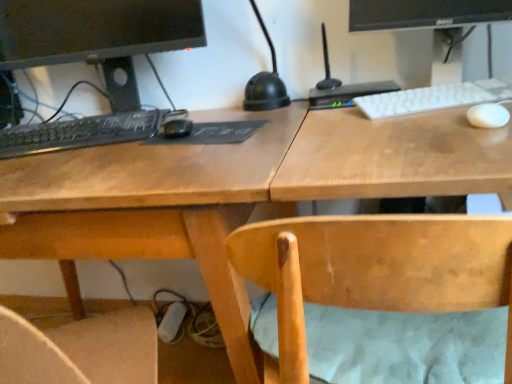
Measure the distance between light brown wood chair at center and camera.

14.85 inches.

Find the location of a particular element. The image size is (512, 384). light brown wood chair at center is located at coordinates (375, 269).

Find the location of a particular element. black matte keyboard at left, positioned as the first computer keyboard in left-to-right order is located at coordinates click(80, 133).

At what (x,y) coordinates should I click in order to perform the action: click on wooden desk at center. Please return your answer as a coordinate pair (x, y). The width and height of the screenshot is (512, 384). Looking at the image, I should click on (238, 190).

This screenshot has height=384, width=512. What do you see at coordinates (238, 190) in the screenshot?
I see `wooden desk at center` at bounding box center [238, 190].

Describe the element at coordinates (425, 13) in the screenshot. I see `black glossy monitor at upper right` at that location.

Locate an element on the screen. This screenshot has height=384, width=512. white matte keyboard at upper right, the 1th computer keyboard in the right-to-left sequence is located at coordinates (434, 98).

The image size is (512, 384). Identify the location of chair that is below the black glossy monitor at upper right (from the image's perspective). (375, 269).

Considering the relative positions of black glossy monitor at upper right and light brown wood chair at center in the image provided, is black glossy monitor at upper right to the left of light brown wood chair at center from the viewer's perspective?

In fact, black glossy monitor at upper right is to the right of light brown wood chair at center.

Consider the image. From the image's perspective, does black glossy monitor at upper right appear lower than light brown wood chair at center?

Incorrect, from the image's perspective, black glossy monitor at upper right is higher than light brown wood chair at center.

In terms of width, does black glossy monitor at upper right look wider or thinner when compared to light brown wood chair at center?

Clearly, black glossy monitor at upper right has less width compared to light brown wood chair at center.

Can you see white matte keyboard at upper right, the 1th computer keyboard in the right-to-left sequence, touching light brown wood chair at center?

No, white matte keyboard at upper right, the 1th computer keyboard in the right-to-left sequence, is not in contact with light brown wood chair at center.

Who is taller, white matte keyboard at upper right, the second computer keyboard in the left-to-right sequence, or light brown wood chair at center?

With more height is light brown wood chair at center.

From a real-world perspective, is white matte keyboard at upper right, the 1th computer keyboard in the right-to-left sequence, on light brown wood chair at center?

Indeed, from a real-world perspective, white matte keyboard at upper right, the 1th computer keyboard in the right-to-left sequence, stands above light brown wood chair at center.

In terms of width, does white matte keyboard at upper right, the second computer keyboard in the left-to-right sequence, look wider or thinner when compared to light brown wood chair at center?

Considering their sizes, white matte keyboard at upper right, the second computer keyboard in the left-to-right sequence, looks slimmer than light brown wood chair at center.

From the image's perspective, would you say white matte keyboard at upper right, the 1th computer keyboard in the right-to-left sequence, is shown under black matte keyboard at left, positioned as the first computer keyboard in left-to-right order?

Actually, white matte keyboard at upper right, the 1th computer keyboard in the right-to-left sequence, appears above black matte keyboard at left, positioned as the first computer keyboard in left-to-right order, in the image.

Who is smaller, white matte keyboard at upper right, the 1th computer keyboard in the right-to-left sequence, or black matte keyboard at left, the 2th computer keyboard in the right-to-left sequence?

white matte keyboard at upper right, the 1th computer keyboard in the right-to-left sequence, is smaller.

Where is `computer keyboard lying behind the white matte keyboard at upper right, the second computer keyboard in the left-to-right sequence`? The width and height of the screenshot is (512, 384). computer keyboard lying behind the white matte keyboard at upper right, the second computer keyboard in the left-to-right sequence is located at coordinates pos(80,133).

Is black matte keyboard at left, the 2th computer keyboard in the right-to-left sequence, beside black matte keyboard at left, which appears as the 1th computer when viewed from the left?

Yes, black matte keyboard at left, the 2th computer keyboard in the right-to-left sequence, and black matte keyboard at left, which appears as the 1th computer when viewed from the left, clearly make contact.

Considering the sizes of objects black matte keyboard at left, the 2th computer keyboard in the right-to-left sequence, and black matte keyboard at left, which appears as the 1th computer when viewed from the left, in the image provided, who is wider, black matte keyboard at left, the 2th computer keyboard in the right-to-left sequence, or black matte keyboard at left, which appears as the 1th computer when viewed from the left,?

Wider between the two is black matte keyboard at left, which appears as the 1th computer when viewed from the left.

Relative to black matte keyboard at left, which appears as the 1th computer when viewed from the left, is black matte keyboard at left, positioned as the first computer keyboard in left-to-right order, in front or behind?

Clearly, black matte keyboard at left, positioned as the first computer keyboard in left-to-right order, is in front of black matte keyboard at left, which appears as the 1th computer when viewed from the left.

Is black matte keyboard at left, positioned as the first computer keyboard in left-to-right order, surrounding black plastic router at upper right, the 1th computer viewed from the right?

That's incorrect, black plastic router at upper right, the 1th computer viewed from the right, is not inside black matte keyboard at left, positioned as the first computer keyboard in left-to-right order.

Is black matte keyboard at left, the 2th computer keyboard in the right-to-left sequence, in front of or behind black plastic router at upper right, positioned as the second computer in left-to-right order, in the image?

In the image, black matte keyboard at left, the 2th computer keyboard in the right-to-left sequence, appears in front of black plastic router at upper right, positioned as the second computer in left-to-right order.

In the image, is black matte keyboard at left, the 2th computer keyboard in the right-to-left sequence, on the left side or the right side of black plastic router at upper right, the 1th computer viewed from the right?

Based on their positions, black matte keyboard at left, the 2th computer keyboard in the right-to-left sequence, is located to the left of black plastic router at upper right, the 1th computer viewed from the right.

Based on their sizes in the image, would you say black matte keyboard at left, positioned as the first computer keyboard in left-to-right order, is bigger or smaller than black plastic router at upper right, the 1th computer viewed from the right?

black matte keyboard at left, positioned as the first computer keyboard in left-to-right order, is smaller than black plastic router at upper right, the 1th computer viewed from the right.

From the image's perspective, would you say black plastic router at upper right, the 1th computer viewed from the right, is positioned over black matte keyboard at left, positioned as the first computer keyboard in left-to-right order?

Yes.

Is the position of black plastic router at upper right, the 1th computer viewed from the right, more distant than that of black matte keyboard at left, positioned as the first computer keyboard in left-to-right order?

Yes, black plastic router at upper right, the 1th computer viewed from the right, is behind black matte keyboard at left, positioned as the first computer keyboard in left-to-right order.

Considering the points (323, 80) and (152, 122), which point is in front, point (323, 80) or point (152, 122)?

Point (152, 122)

Does point (500, 109) appear closer or farther from the camera than point (41, 152)?

Point (500, 109).

From a real-world perspective, is white matte mouse at upper right above or below black matte keyboard at left, positioned as the first computer keyboard in left-to-right order?

white matte mouse at upper right is situated lower than black matte keyboard at left, positioned as the first computer keyboard in left-to-right order, in the real world.

Can you confirm if white matte mouse at upper right is positioned to the right of black matte keyboard at left, positioned as the first computer keyboard in left-to-right order?

Yes.

Considering the sizes of objects white matte mouse at upper right and black matte keyboard at left, positioned as the first computer keyboard in left-to-right order, in the image provided, who is thinner, white matte mouse at upper right or black matte keyboard at left, positioned as the first computer keyboard in left-to-right order,?

white matte mouse at upper right.

Locate an element on the screen. This screenshot has height=384, width=512. chair in front of the black glossy monitor at upper right is located at coordinates (375, 269).

Starting from the light brown wood chair at center, which computer keyboard is the 1st one behind? Please provide its 2D coordinates.

[(434, 98)]

Estimate the real-world distances between objects in this image. Which object is closer to black matte keyboard at left, which appears as the 1th computer when viewed from the left, black matte keyboard at left, the 2th computer keyboard in the right-to-left sequence, or black plastic router at upper right, positioned as the second computer in left-to-right order?

black matte keyboard at left, the 2th computer keyboard in the right-to-left sequence.

Looking at the image, which one is located closer to black matte keyboard at left, positioned as the first computer keyboard in left-to-right order, white matte mouse at upper right or wooden desk at center?

wooden desk at center lies closer to black matte keyboard at left, positioned as the first computer keyboard in left-to-right order, than the other object.

Looking at the image, which one is located closer to white matte mouse at upper right, black matte keyboard at left, which is the 2th computer in right-to-left order, or black plastic router at upper right, the 1th computer viewed from the right?

black plastic router at upper right, the 1th computer viewed from the right.

Looking at the image, which one is located closer to white matte mouse at upper right, wooden desk at center or white matte keyboard at upper right, the second computer keyboard in the left-to-right sequence?

white matte keyboard at upper right, the second computer keyboard in the left-to-right sequence, lies closer to white matte mouse at upper right than the other object.

Estimate the real-world distances between objects in this image. Which object is closer to black matte keyboard at left, the 2th computer keyboard in the right-to-left sequence, black glossy monitor at upper right or wooden desk at center?

wooden desk at center is closer to black matte keyboard at left, the 2th computer keyboard in the right-to-left sequence.

Which object lies further to the anchor point black matte keyboard at left, the 2th computer keyboard in the right-to-left sequence, light brown wood chair at center or black glossy monitor at upper right?

Based on the image, black glossy monitor at upper right appears to be further to black matte keyboard at left, the 2th computer keyboard in the right-to-left sequence.

Based on their spatial positions, is wooden desk at center or black matte keyboard at left, positioned as the first computer keyboard in left-to-right order, further from light brown wood chair at center?

Among the two, black matte keyboard at left, positioned as the first computer keyboard in left-to-right order, is located further to light brown wood chair at center.

From the image, which object appears to be nearer to white matte mouse at upper right, black matte keyboard at left, positioned as the first computer keyboard in left-to-right order, or wooden desk at center?

Based on the image, wooden desk at center appears to be nearer to white matte mouse at upper right.

At what (x,y) coordinates should I click in order to perform the action: click on chair between black matte keyboard at left, which is the 2th computer in right-to-left order, and black glossy monitor at upper right, in the horizontal direction. Please return your answer as a coordinate pair (x, y). This screenshot has height=384, width=512. Looking at the image, I should click on (375, 269).

Find the location of a particular element. computer monitor between wooden desk at center and white matte keyboard at upper right, the second computer keyboard in the left-to-right sequence, from left to right is located at coordinates (425, 13).

I want to click on desk located between black matte keyboard at left, which appears as the 1th computer when viewed from the left, and white matte keyboard at upper right, the second computer keyboard in the left-to-right sequence, in the left-right direction, so click(238, 190).

The height and width of the screenshot is (384, 512). I want to click on desk between black matte keyboard at left, which is the 2th computer in right-to-left order, and black plastic router at upper right, the 1th computer viewed from the right, so click(238, 190).